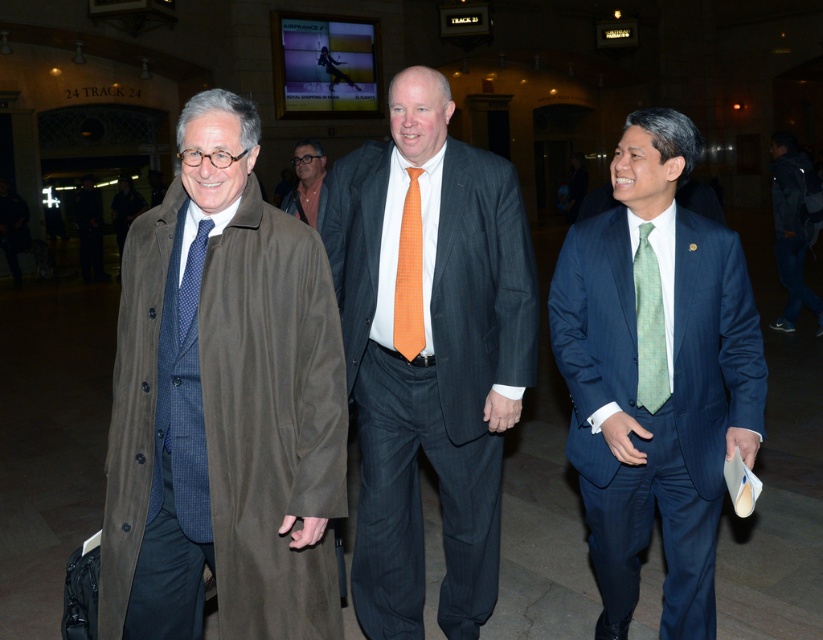
Question: Considering the real-world distances, which object is closest to the green plaid tie at right?

Choices:
 (A) dark blue jeans at lower right
 (B) blue dotted tie at center
 (C) orange checkered tie at center
 (D) matte black jacket at center

Answer: (C)

Question: Is green plaid tie at right above matte black jacket at center?

Choices:
 (A) no
 (B) yes

Answer: (A)

Question: Which object is the closest to the green plaid tie at right?

Choices:
 (A) brown leather coat at left
 (B) blue pinstripe suit at center
 (C) dark blue jeans at lower right

Answer: (B)

Question: Among these objects, which one is farthest from the camera?

Choices:
 (A) dark blue jeans at lower right
 (B) matte black jacket at center
 (C) orange checkered tie at center
 (D) blue pinstripe suit at center

Answer: (A)

Question: Is dark blue jeans at lower right wider than green plaid tie at right?

Choices:
 (A) no
 (B) yes

Answer: (B)

Question: Can you confirm if orange pinstripe suit at center is positioned below green plaid tie at right?

Choices:
 (A) no
 (B) yes

Answer: (B)